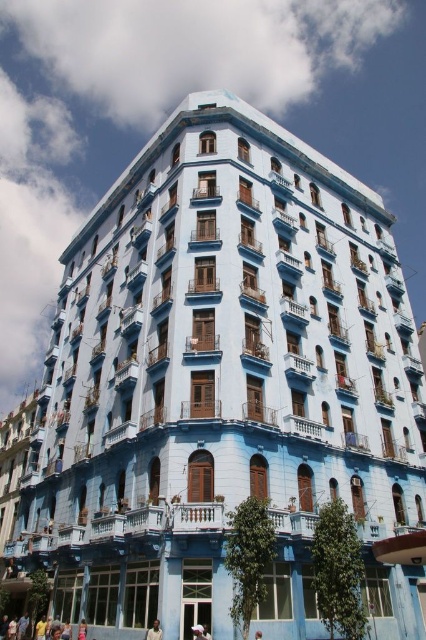
From the picture: Which is more to the right, dark skin smooth face at center or reddish-brown leather cap at center?

Positioned to the right is reddish-brown leather cap at center.

Which is below, dark skin smooth face at center or reddish-brown leather cap at center?

Positioned lower is reddish-brown leather cap at center.

Is point (150, 636) farther from viewer compared to point (258, 637)?

That is False.

Find the location of a particular element. Image resolution: width=426 pixels, height=640 pixels. dark skin smooth face at center is located at coordinates (154, 632).

You are a GUI agent. You are given a task and a screenshot of the screen. Output one action in this format:
    pyautogui.click(x=<x>, y=<y>)
    Task: Click on the dark skin smooth face at center
    The width and height of the screenshot is (426, 640).
    Given the screenshot: What is the action you would take?
    pyautogui.click(x=154, y=632)

Which is in front, point (158, 621) or point (80, 636)?

Point (158, 621) is in front.

Image resolution: width=426 pixels, height=640 pixels. I want to click on dark skin smooth face at center, so click(154, 632).

Is dark skin smooth face at center shorter than white fabric at center?

Incorrect, dark skin smooth face at center's height does not fall short of white fabric at center's.

Which is behind, point (154, 637) or point (204, 632)?

The point (204, 632) is more distant.

Locate an element on the screen. Image resolution: width=426 pixels, height=640 pixels. dark skin smooth face at center is located at coordinates (154, 632).